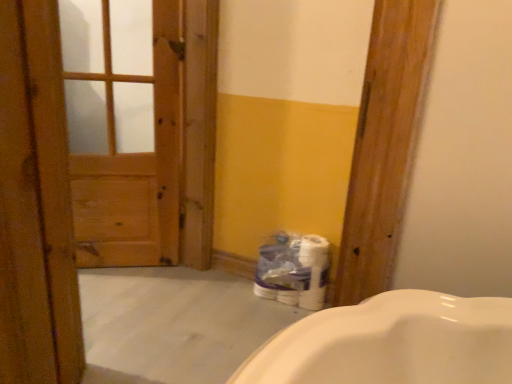
This screenshot has width=512, height=384. Find the location of `vacant space in front of white glossy toilet paper at lower center`. vacant space in front of white glossy toilet paper at lower center is located at coordinates (268, 320).